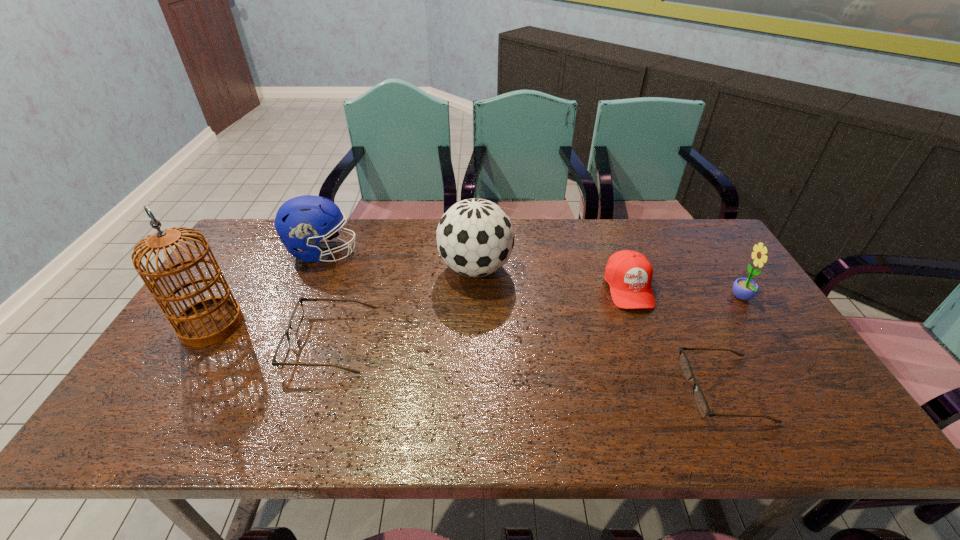
Find the location of `free space located on the front-facing side of the left spectacles`. free space located on the front-facing side of the left spectacles is located at coordinates (238, 340).

At what (x,y) coordinates should I click in order to perform the action: click on free spot located on the front-facing side of the left spectacles. Please return your answer as a coordinate pair (x, y). This screenshot has height=540, width=960. Looking at the image, I should click on (265, 340).

Identify the location of vacant space located on the front-facing side of the left spectacles. (207, 340).

I want to click on free spot located on the front-facing side of the right spectacles, so (582, 389).

Where is `vacant space located 0.240m on the front-facing side of the right spectacles`? vacant space located 0.240m on the front-facing side of the right spectacles is located at coordinates (587, 389).

What are the coordinates of `vacant region located 0.140m on the front-facing side of the right spectacles` in the screenshot? It's located at (629, 389).

This screenshot has width=960, height=540. In order to click on free space located 0.100m on the front of the soccer ball in this screenshot , I will do `click(475, 319)`.

You are a GUI agent. You are given a task and a screenshot of the screen. Output one action in this format:
    pyautogui.click(x=<x>, y=<y>)
    Task: Click on the vacant region located on the front-facing side of the football helmet
    
    Given the screenshot: What is the action you would take?
    pyautogui.click(x=472, y=252)

What are the coordinates of `vacant space positioned 0.280m on the front panel of the baseball cap` in the screenshot? It's located at (670, 400).

You are a GUI agent. You are given a task and a screenshot of the screen. Output one action in this format:
    pyautogui.click(x=<x>, y=<y>)
    Task: Click on the vacant space located on the back of the leftmost object
    The height and width of the screenshot is (540, 960).
    Given the screenshot: What is the action you would take?
    pyautogui.click(x=262, y=243)